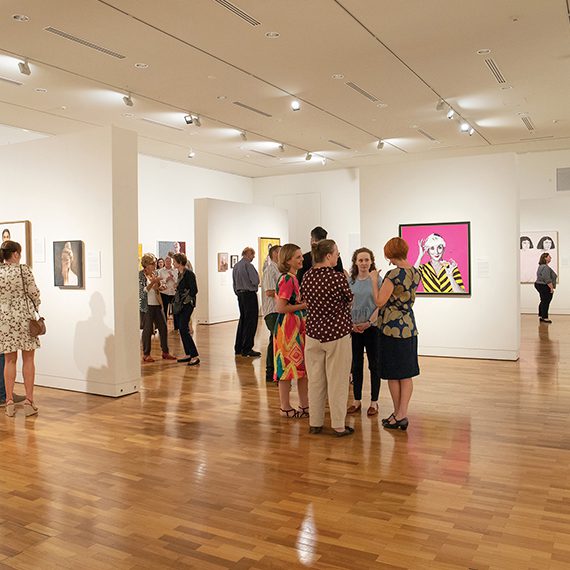
Locate an element on the screen. The image size is (570, 570). picture is located at coordinates (445, 250).